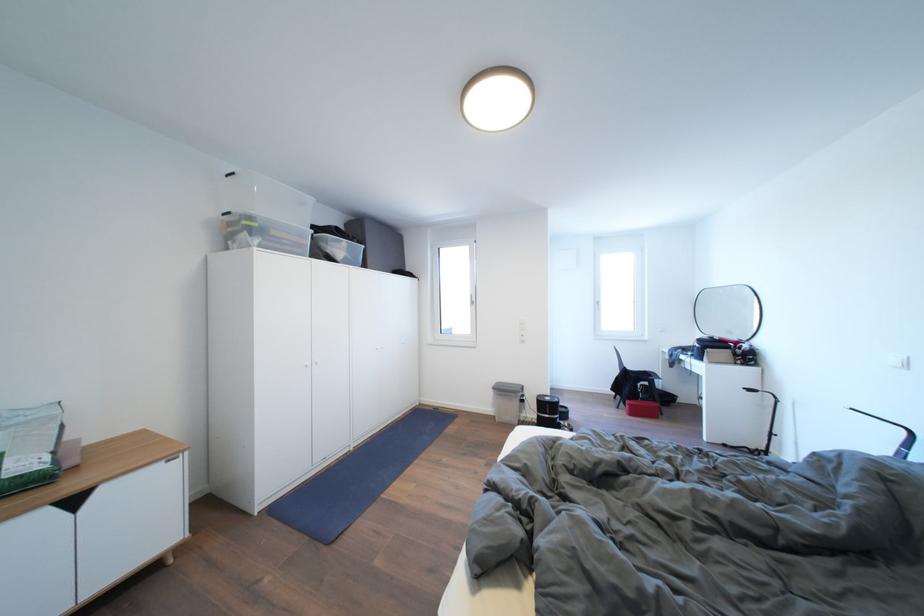
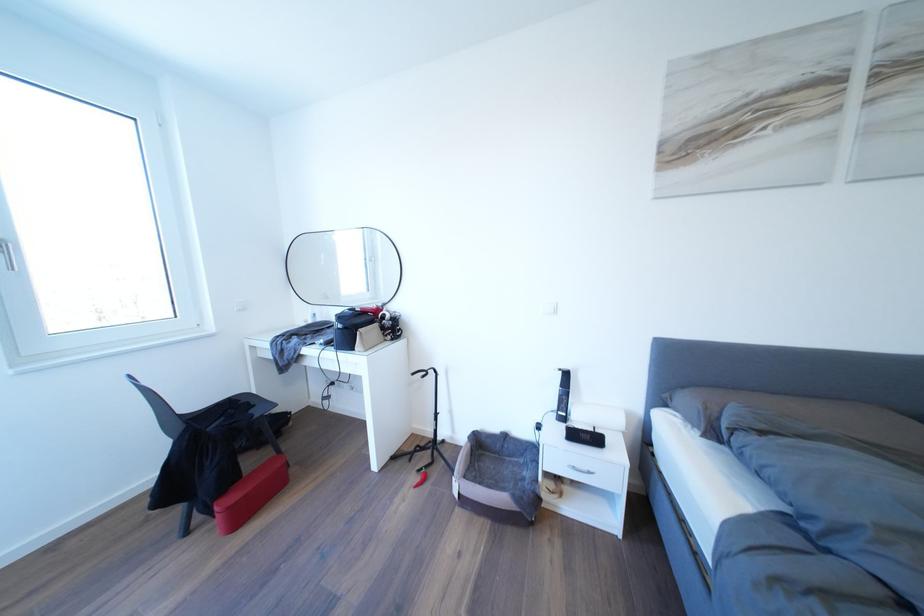
Where in the second image is the point corresponding to point 737,338 from the first image?

(334, 302)